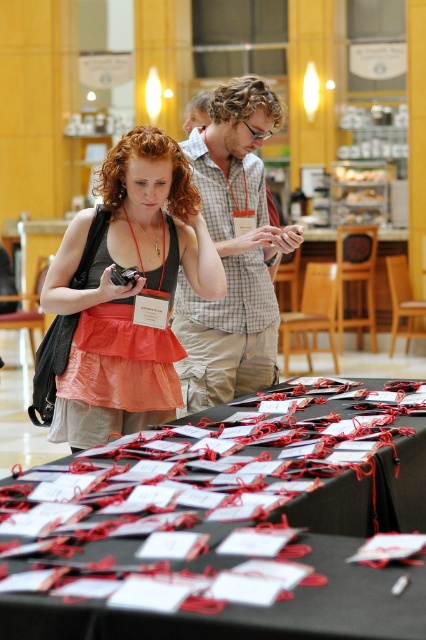
Can you confirm if black paper bag at lower center is shorter than matte black camera at left?

Correct, black paper bag at lower center is not as tall as matte black camera at left.

What do you see at coordinates (219, 536) in the screenshot? I see `black paper bag at lower center` at bounding box center [219, 536].

Who is more forward, [420,440] or [141,170]?

Point [420,440] is more forward.

What are the coordinates of `black paper bag at lower center` in the screenshot? It's located at (219, 536).

Between point (262, 512) and point (233, 161), which one is positioned behind?

Point (233, 161)

Which is above, black paper bag at lower center or checkered fabric shirt at center?

checkered fabric shirt at center

The image size is (426, 640). What are the coordinates of `black paper bag at lower center` in the screenshot? It's located at (219, 536).

The image size is (426, 640). I want to click on black paper bag at lower center, so click(219, 536).

Is matte black camera at left thinner than checkered fabric shirt at center?

In fact, matte black camera at left might be wider than checkered fabric shirt at center.

What do you see at coordinates (129, 291) in the screenshot? The image size is (426, 640). I see `matte black camera at left` at bounding box center [129, 291].

Identify the location of matte black camera at left. (129, 291).